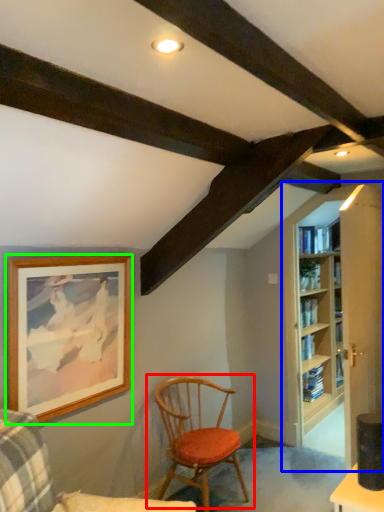
Question: Estimate the real-world distances between objects in this image. Which object is closer to chair (highlighted by a red box), bookcase (highlighted by a blue box) or picture frame (highlighted by a green box)?

Choices:
 (A) bookcase
 (B) picture frame

Answer: (B)